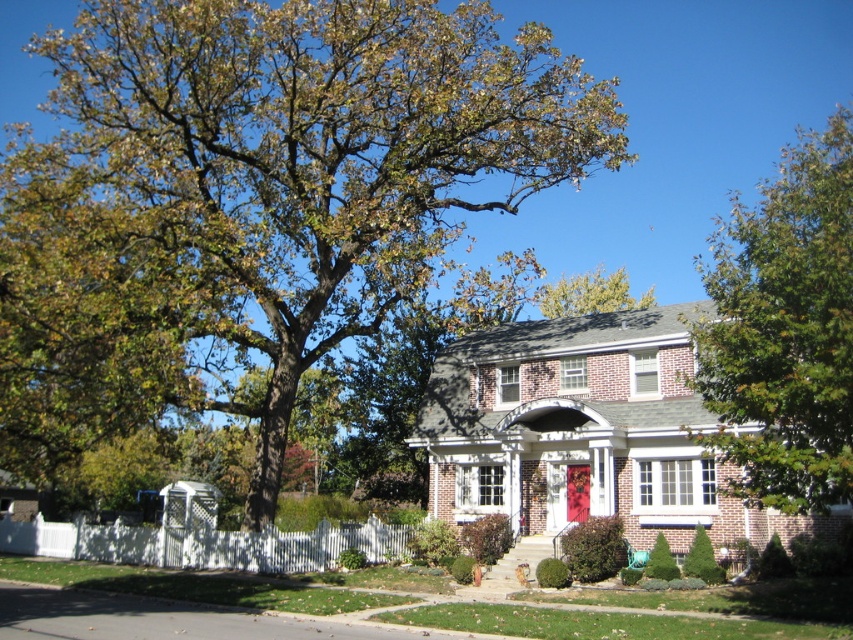
The width and height of the screenshot is (853, 640). I want to click on green leafy tree at upper right, so click(x=784, y=330).

Is green leafy tree at upper right bigger than red matte door at center?

Yes.

The image size is (853, 640). I want to click on green leafy tree at upper right, so click(x=784, y=330).

Find the location of a particular element. green leafy tree at upper right is located at coordinates (784, 330).

Does point (556, 291) come closer to viewer compared to point (572, 481)?

No, it is behind (572, 481).

What are the coordinates of `green leafy tree at upper center` in the screenshot? It's located at (590, 294).

From the picture: Is green leafy tree at center further to the viewer compared to green leafy tree at upper center?

No, green leafy tree at center is in front of green leafy tree at upper center.

Based on the photo, does green leafy tree at center appear on the left side of green leafy tree at upper center?

Indeed, green leafy tree at center is positioned on the left side of green leafy tree at upper center.

Which is behind, point (241, 13) or point (619, 307)?

Point (619, 307)

You are a GUI agent. You are given a task and a screenshot of the screen. Output one action in this format:
    pyautogui.click(x=<x>, y=<y>)
    Task: Click on the green leafy tree at center
    
    Given the screenshot: What is the action you would take?
    pyautogui.click(x=254, y=198)